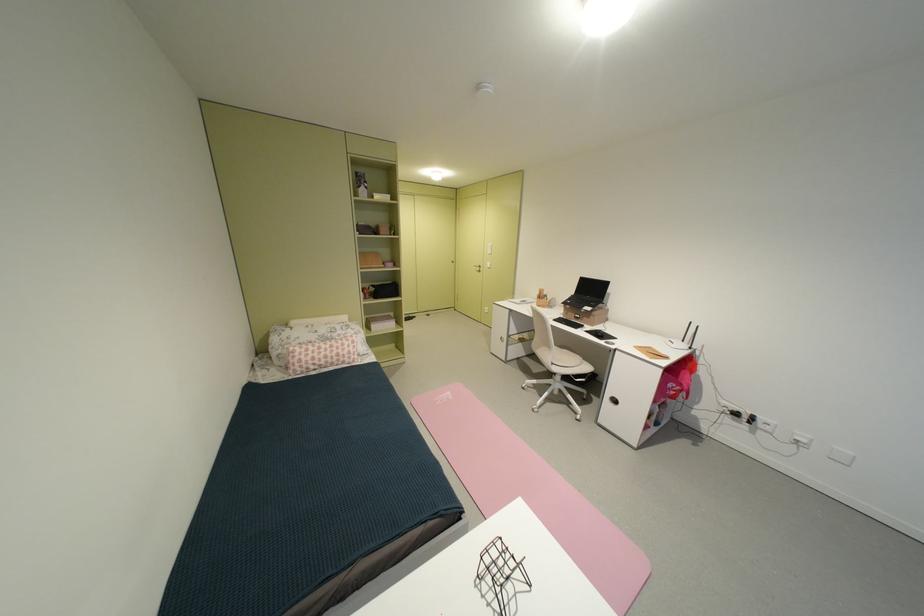
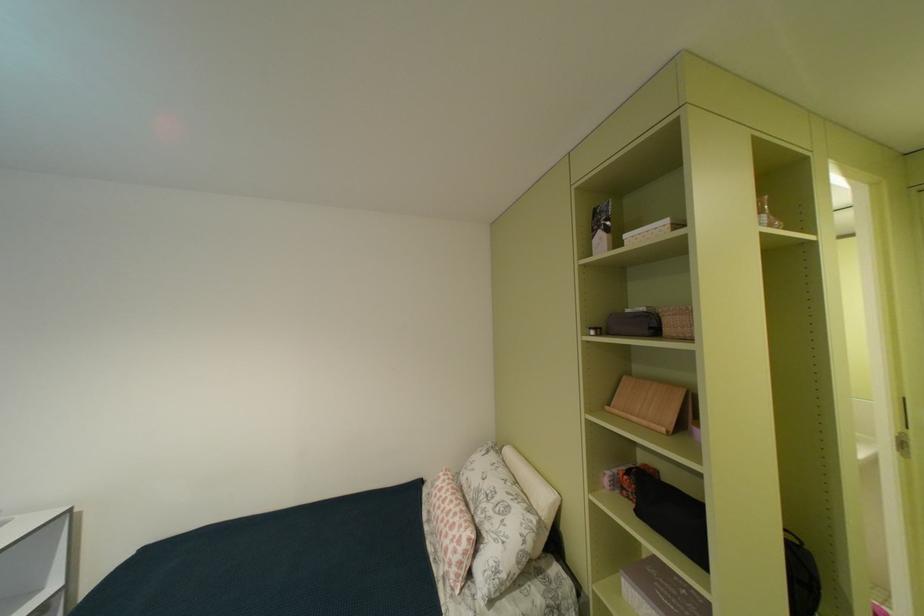
In the second image, find the point that corresponds to pixel 361 352 in the first image.

(458, 556)